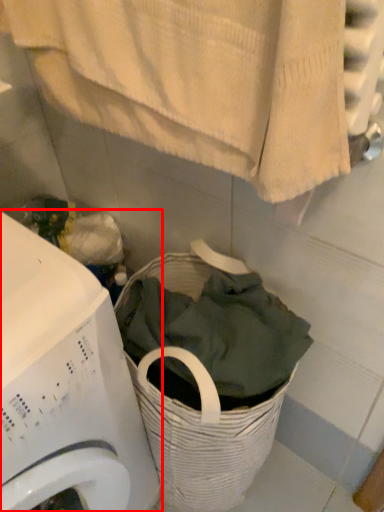
Question: Considering the relative positions of washing machine (annotated by the red box) and bath towel in the image provided, where is washing machine (annotated by the red box) located with respect to the staircase?

Choices:
 (A) right
 (B) left

Answer: (B)